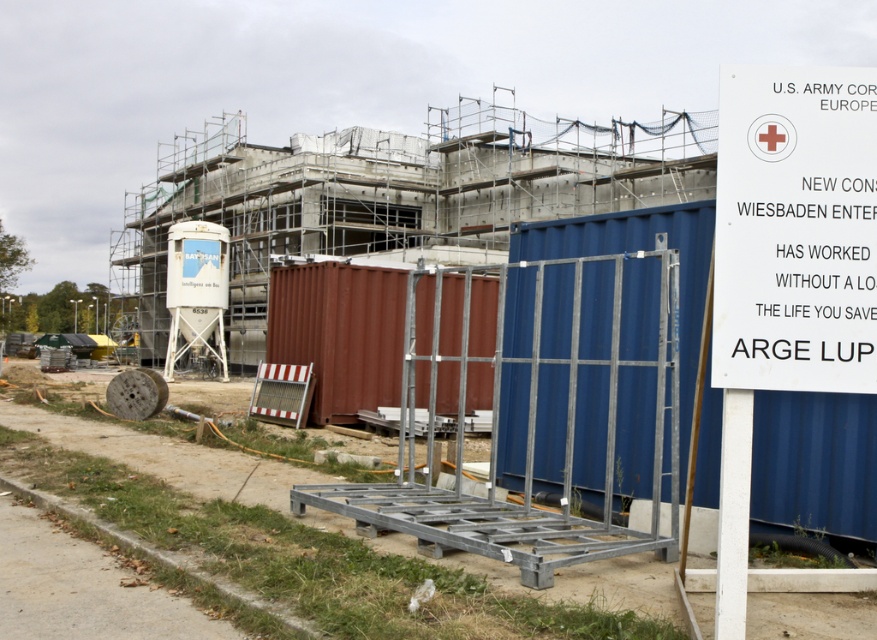
Which of these two, white paper sign at upper right or rusty metal shipping container at center, stands shorter?

With less height is white paper sign at upper right.

Is point (752, 202) in front of point (348, 308)?

That is True.

Locate an element on the screen. This screenshot has width=877, height=640. white paper sign at upper right is located at coordinates (795, 230).

Which is above, blue metallic shipping container at right or rusty metal shipping container at center?

rusty metal shipping container at center

Who is more forward, (501, 419) or (369, 376)?

Point (501, 419) is in front.

Identify the location of blue metallic shipping container at right. This screenshot has height=640, width=877. pos(815,465).

Is blue metallic shipping container at right shorter than white paper sign at upper right?

In fact, blue metallic shipping container at right may be taller than white paper sign at upper right.

The height and width of the screenshot is (640, 877). In order to click on blue metallic shipping container at right in this screenshot , I will do `click(815, 465)`.